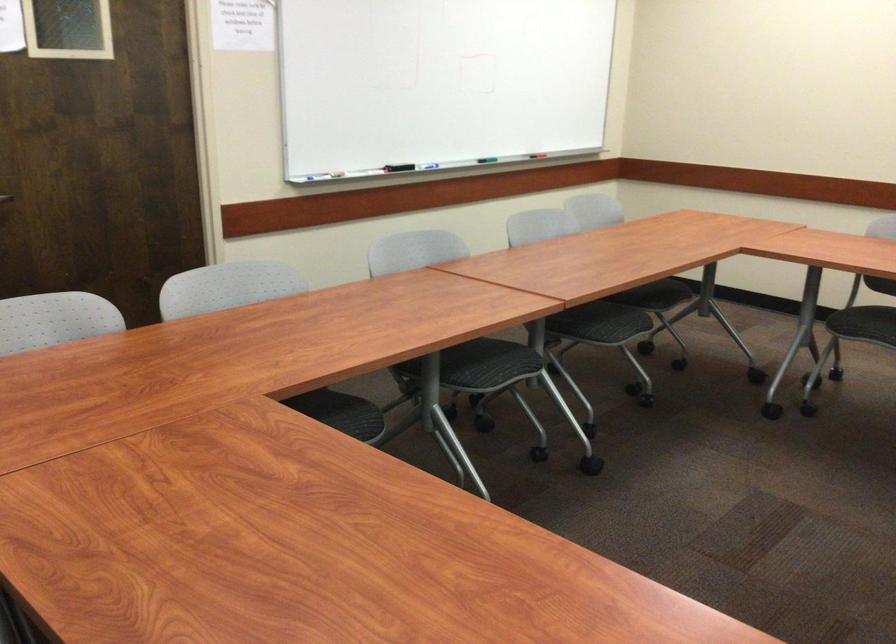
You are a GUI agent. You are given a task and a screenshot of the screen. Output one action in this format:
    pyautogui.click(x=<x>, y=<y>)
    Task: Click on the green whiteboard marker
    
    Given the screenshot: What is the action you would take?
    pyautogui.click(x=438, y=82)